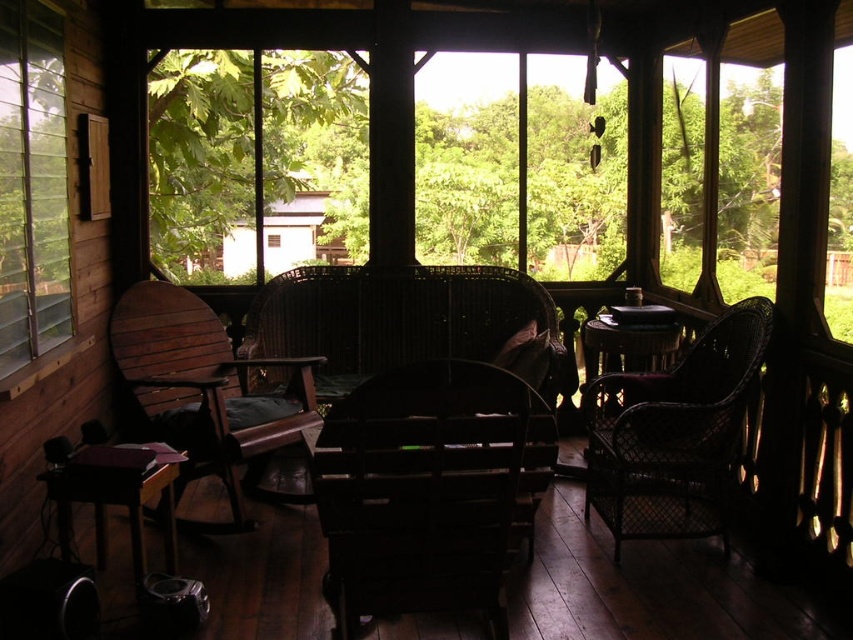
The width and height of the screenshot is (853, 640). I want to click on dark wood rocking chair at center, so click(x=650, y=588).

Is dark brown wicker chair at center to the left of wooden armchair at left from the viewer's perspective?

In fact, dark brown wicker chair at center is to the right of wooden armchair at left.

Who is shorter, dark brown wicker chair at center or wooden armchair at left?

dark brown wicker chair at center

At what (x,y) coordinates should I click in order to perform the action: click on dark brown wicker chair at center. Please return your answer as a coordinate pair (x, y). Looking at the image, I should click on (426, 490).

Which of these two, dark wood rocking chair at center or woven dark brown chair at right, stands taller?

With more height is woven dark brown chair at right.

You are a GUI agent. You are given a task and a screenshot of the screen. Output one action in this format:
    pyautogui.click(x=<x>, y=<y>)
    Task: Click on the dark wood rocking chair at center
    Image resolution: width=853 pixels, height=640 pixels.
    Given the screenshot: What is the action you would take?
    pyautogui.click(x=650, y=588)

Find the location of a particular element. dark wood rocking chair at center is located at coordinates (650, 588).